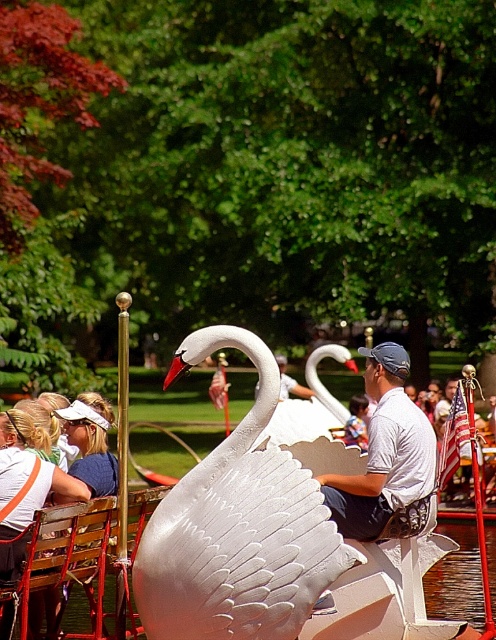
Question: Which object appears closest to the camera in this image?

Choices:
 (A) white matte swan at center
 (B) white glossy swan at center
 (C) wooden chair at lower left

Answer: (B)

Question: Does white matte swan at center lie in front of wooden chair at lower left?

Choices:
 (A) yes
 (B) no

Answer: (B)

Question: Which object appears farthest from the camera in this image?

Choices:
 (A) white matte swan at center
 (B) white glossy swan at center

Answer: (A)

Question: Is white matte swan at center to the left of wooden chair at lower left from the viewer's perspective?

Choices:
 (A) yes
 (B) no

Answer: (B)

Question: Does white matte swan at center come in front of wooden chair at lower left?

Choices:
 (A) no
 (B) yes

Answer: (A)

Question: Which point is farther to the camera?

Choices:
 (A) (233, 614)
 (B) (101, 586)

Answer: (B)